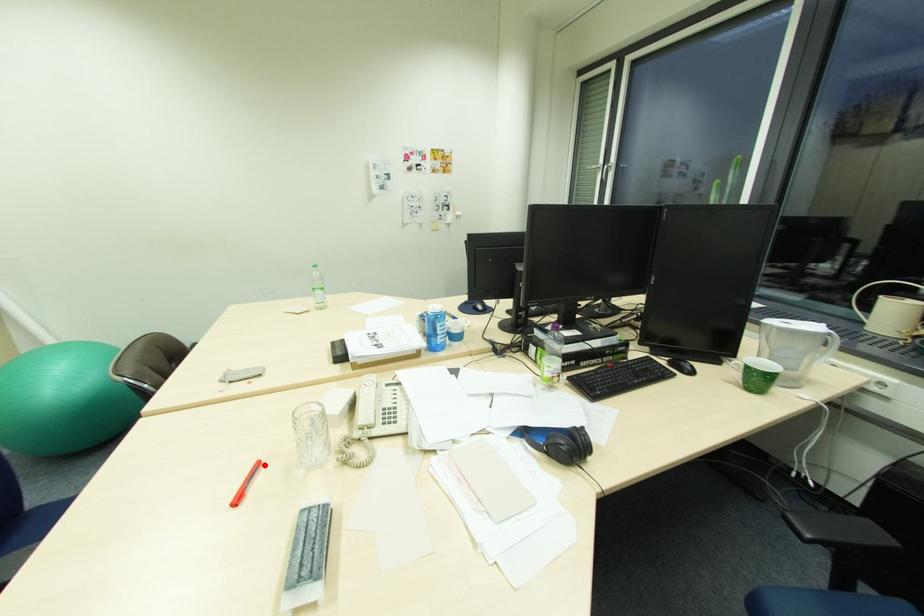
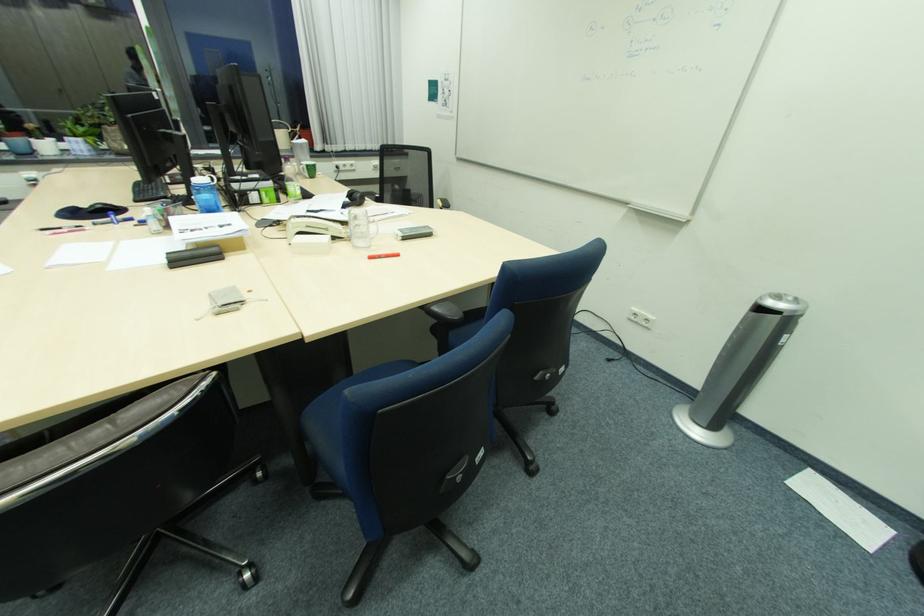
Locate, in the second image, the point that corresponds to the highlighted location in the first image.

(377, 257)